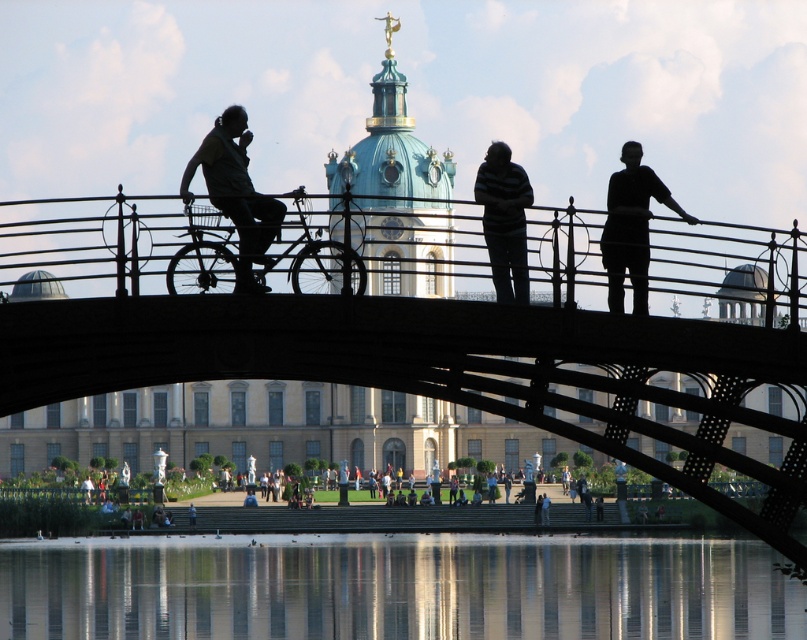
Question: Among these objects, which one is nearest to the camera?

Choices:
 (A) striped sweater at center
 (B) black metal bridge at center
 (C) silhouette fabric-covered figure at left
 (D) transparent glass water at center

Answer: (B)

Question: Is transparent glass water at center smaller than silhouette fabric-covered figure at left?

Choices:
 (A) no
 (B) yes

Answer: (A)

Question: Which point is farther to the camera?

Choices:
 (A) black metal bridge at center
 (B) transparent glass water at center
 (C) striped sweater at center

Answer: (B)

Question: Does silhouette fabric-covered figure at left have a greater width compared to striped sweater at center?

Choices:
 (A) no
 (B) yes

Answer: (B)

Question: Does matte black bicycle at left appear on the right side of silhouette fabric-covered figure at left?

Choices:
 (A) yes
 (B) no

Answer: (A)

Question: Which point appears farthest from the camera in this image?

Choices:
 (A) (207, 275)
 (B) (270, 218)

Answer: (B)